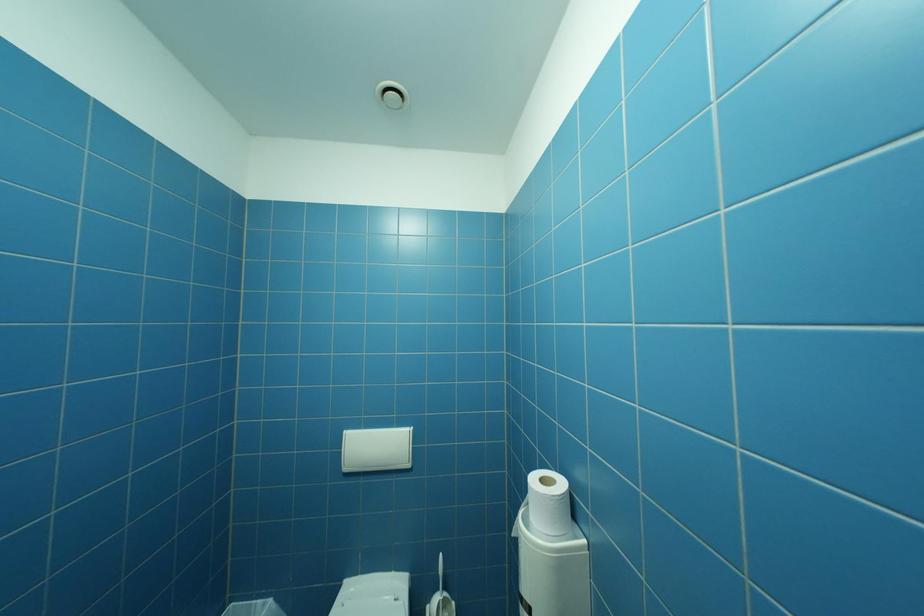
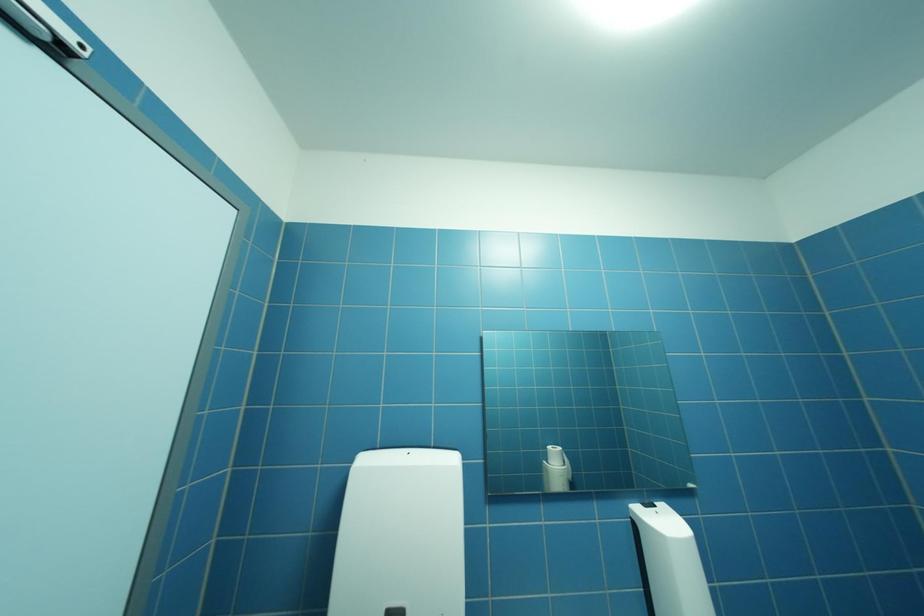
The first image is from the beginning of the video and the second image is from the end. How did the camera likely rotate when shooting the video?

The rotation direction of the camera is left-up.